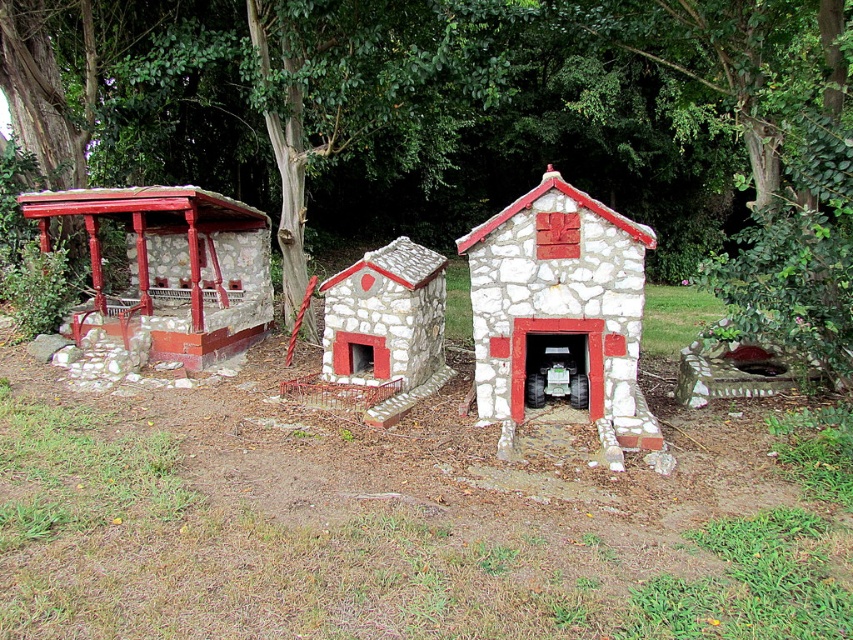
You are standing at point (560, 314) in the outdoor scene. What object is located exactly at your current position?

The white stone fireplace at center is located exactly at point (560, 314).

You are planning to place a new bench in the garden. The bench requires a space that is wider than the white stone fireplace at center. Can the area near the brushed metal gazebo at left accommodate this bench?

The white stone fireplace at center has a lesser width compared to the brushed metal gazebo at left. Since the bench requires a space wider than the white stone fireplace at center, the area near the brushed metal gazebo at left can accommodate the bench because it is wider.

You are standing at the point labeled as point (476, 124) in the scene. Looking around, you see three miniature stone houses with red roofs. Which direction should you face to see the green leafy tree at upper center?

The point (476, 124) is labeled as the green leafy tree at upper center, so you are already facing it.